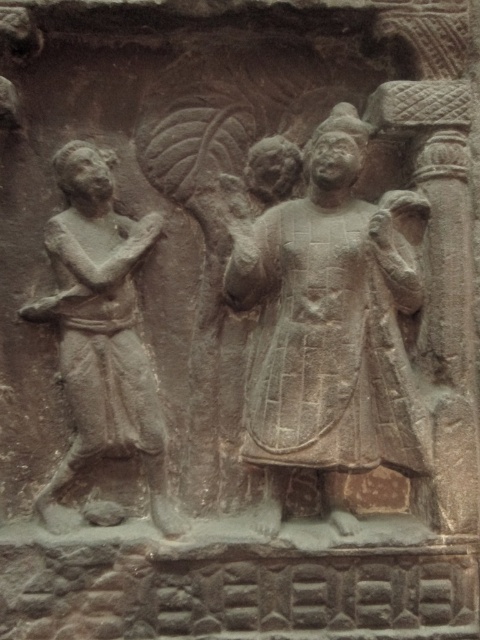
Question: Which point is farther to the camera?

Choices:
 (A) gray stone figure at left
 (B) carved stone figure at center

Answer: (B)

Question: Is the position of carved stone figure at center less distant than that of gray stone figure at left?

Choices:
 (A) no
 (B) yes

Answer: (A)

Question: Which point is closer to the camera?

Choices:
 (A) (264, 410)
 (B) (145, 381)

Answer: (A)

Question: Can you confirm if carved stone figure at center is positioned to the left of gray stone figure at left?

Choices:
 (A) no
 (B) yes

Answer: (A)

Question: Which of the following is the farthest from the observer?

Choices:
 (A) gray stone figure at left
 (B) carved stone figure at center

Answer: (B)

Question: Is carved stone figure at center above gray stone figure at left?

Choices:
 (A) yes
 (B) no

Answer: (A)